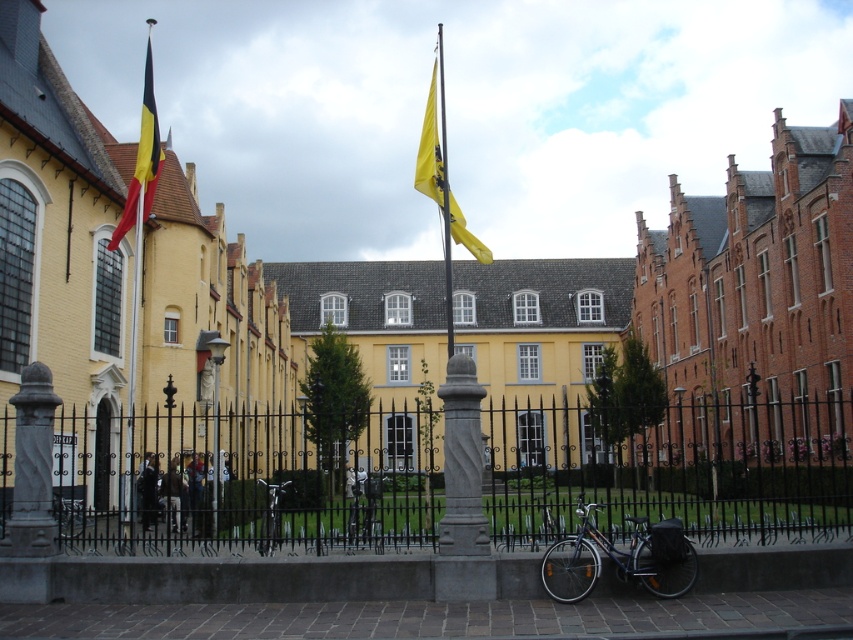
Describe the element at coordinates (142, 160) in the screenshot. I see `matte black flag at left` at that location.

Is matte black flag at left below shiny metallic bicycle at center?

No.

Is point (152, 88) more distant than point (276, 516)?

Yes, point (152, 88) is farther from viewer.

Find the location of `matte black flag at left`. matte black flag at left is located at coordinates (142, 160).

Which is behind, point (62, 513) or point (584, 564)?

Point (62, 513)

Image resolution: width=853 pixels, height=640 pixels. What are the coordinates of `black wrought iron fence at center` in the screenshot? It's located at (242, 481).

The width and height of the screenshot is (853, 640). What do you see at coordinates (242, 481) in the screenshot?
I see `black wrought iron fence at center` at bounding box center [242, 481].

Image resolution: width=853 pixels, height=640 pixels. Find the location of `black wrought iron fence at center`. black wrought iron fence at center is located at coordinates (242, 481).

You are a GUI agent. You are given a task and a screenshot of the screen. Output one action in this format:
    pyautogui.click(x=<x>, y=<y>)
    Task: Click on the yellow fabric flagpole at center
    
    Given the screenshot: What is the action you would take?
    pyautogui.click(x=445, y=202)

Based on the photo, is yellow fabric flagpole at center in front of shiny metallic bicycle at center?

No, yellow fabric flagpole at center is further to the viewer.

Identify the location of yellow fabric flagpole at center. The height and width of the screenshot is (640, 853). (445, 202).

At what (x,y) coordinates should I click in order to perform the action: click on yellow fabric flagpole at center. Please return your answer as a coordinate pair (x, y). Looking at the image, I should click on (445, 202).